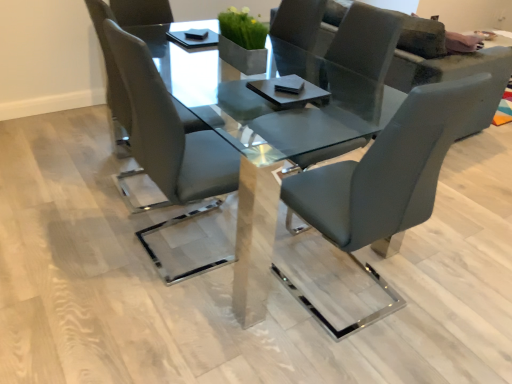
Question: From a real-world perspective, is satin grey leather chair at center, which is counted as the first chair, starting from the left, under matte gray chair at center, which is the 2th chair in left-to-right order?

Choices:
 (A) yes
 (B) no

Answer: (A)

Question: Is satin grey leather chair at center, marked as the 3th chair in a right-to-left arrangement, shorter than matte gray chair at center, which is the 2th chair in left-to-right order?

Choices:
 (A) no
 (B) yes

Answer: (A)

Question: Is satin grey leather chair at center, marked as the 3th chair in a right-to-left arrangement, smaller than matte gray chair at center, which is the 2th chair in left-to-right order?

Choices:
 (A) no
 (B) yes

Answer: (B)

Question: Can we say satin grey leather chair at center, marked as the 3th chair in a right-to-left arrangement, lies outside matte gray chair at center, which is the 2th chair in left-to-right order?

Choices:
 (A) yes
 (B) no

Answer: (A)

Question: Considering the relative sizes of satin grey leather chair at center, marked as the 3th chair in a right-to-left arrangement, and matte gray chair at center, which appears as the 2th chair when viewed from the right, in the image provided, is satin grey leather chair at center, marked as the 3th chair in a right-to-left arrangement, thinner than matte gray chair at center, which appears as the 2th chair when viewed from the right,?

Choices:
 (A) no
 (B) yes

Answer: (B)

Question: From the image's perspective, is matte gray chair at center, which is the 2th chair in left-to-right order, located above or below matte gray couch at upper right?

Choices:
 (A) above
 (B) below

Answer: (B)

Question: Is matte gray chair at center, which appears as the 2th chair when viewed from the right, bigger or smaller than matte gray couch at upper right?

Choices:
 (A) big
 (B) small

Answer: (B)

Question: Is matte gray chair at center, which is the 2th chair in left-to-right order, in front of or behind matte gray couch at upper right in the image?

Choices:
 (A) behind
 (B) front

Answer: (B)

Question: In terms of width, does matte gray chair at center, which appears as the 2th chair when viewed from the right, look wider or thinner when compared to matte gray couch at upper right?

Choices:
 (A) thin
 (B) wide

Answer: (A)

Question: From a real-world perspective, relative to matte gray chair at center, which is the 2th chair in left-to-right order, is matte gray couch at upper right vertically above or below?

Choices:
 (A) below
 (B) above

Answer: (A)

Question: From the image's perspective, relative to matte gray chair at center, which is the 2th chair in left-to-right order, is matte gray couch at upper right above or below?

Choices:
 (A) below
 (B) above

Answer: (B)

Question: Is matte gray couch at upper right taller or shorter than matte gray chair at center, which is the 2th chair in left-to-right order?

Choices:
 (A) short
 (B) tall

Answer: (A)

Question: Looking at their shapes, would you say matte gray couch at upper right is wider or thinner than matte gray chair at center, which appears as the 2th chair when viewed from the right?

Choices:
 (A) wide
 (B) thin

Answer: (A)

Question: Is clear glass table at center spatially inside satin grey leather chair at center, which is counted as the first chair, starting from the left, or outside of it?

Choices:
 (A) inside
 (B) outside

Answer: (B)

Question: Visually, is clear glass table at center positioned to the left or to the right of satin grey leather chair at center, marked as the 3th chair in a right-to-left arrangement?

Choices:
 (A) right
 (B) left

Answer: (A)